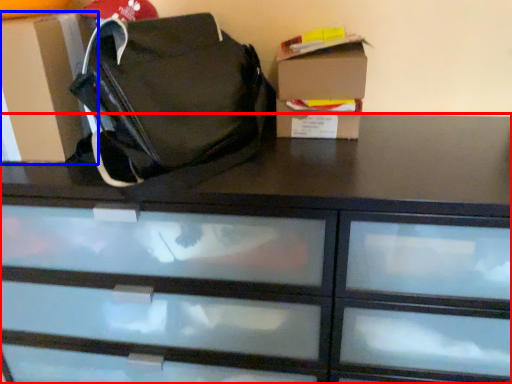
Question: Among these objects, which one is farthest to the camera, chest of drawers (highlighted by a red box) or cardboard box (highlighted by a blue box)?

Choices:
 (A) chest of drawers
 (B) cardboard box

Answer: (B)